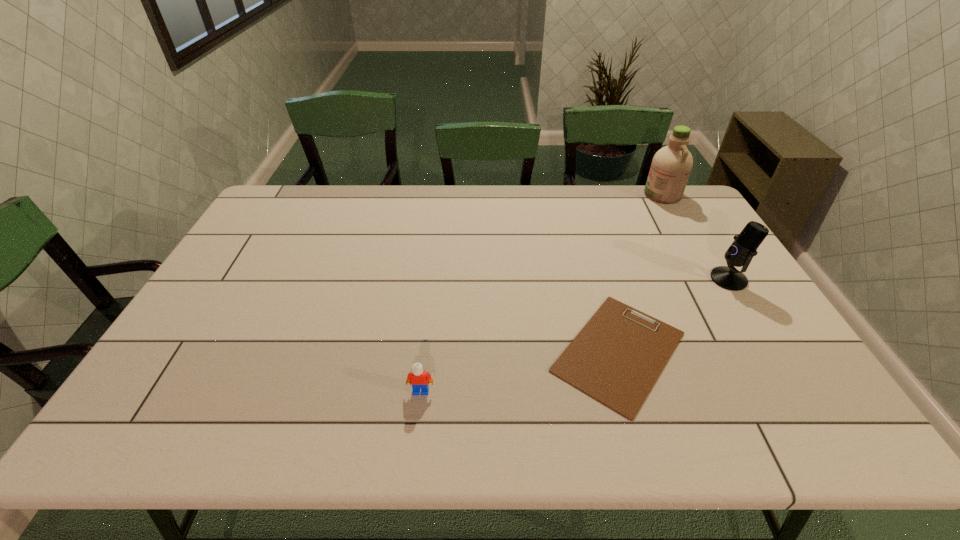
The height and width of the screenshot is (540, 960). In order to click on cleansing agent in this screenshot , I will do `click(671, 165)`.

Image resolution: width=960 pixels, height=540 pixels. In order to click on the tallest object in this screenshot , I will do `click(671, 165)`.

Find the location of a particular element. the third shortest object is located at coordinates (740, 253).

Find the location of `the second farthest object`. the second farthest object is located at coordinates (740, 253).

You are a GUI agent. You are given a task and a screenshot of the screen. Output one action in this format:
    pyautogui.click(x=<x>, y=<y>)
    Task: Click on the leftmost object
    
    Given the screenshot: What is the action you would take?
    pyautogui.click(x=418, y=378)

Identify the location of the third tallest object. This screenshot has width=960, height=540. [x=418, y=378].

Where is `the second object from left to right`? The height and width of the screenshot is (540, 960). the second object from left to right is located at coordinates (617, 357).

At what (x,y) coordinates should I click in order to perform the action: click on the shortest object. Please return your answer as a coordinate pair (x, y). Image resolution: width=960 pixels, height=540 pixels. Looking at the image, I should click on (617, 357).

Locate an element on the screen. blank space located 0.300m on the front label of the farthest object is located at coordinates (564, 194).

Where is `vacant space situated on the front label of the farthest object`? vacant space situated on the front label of the farthest object is located at coordinates (577, 194).